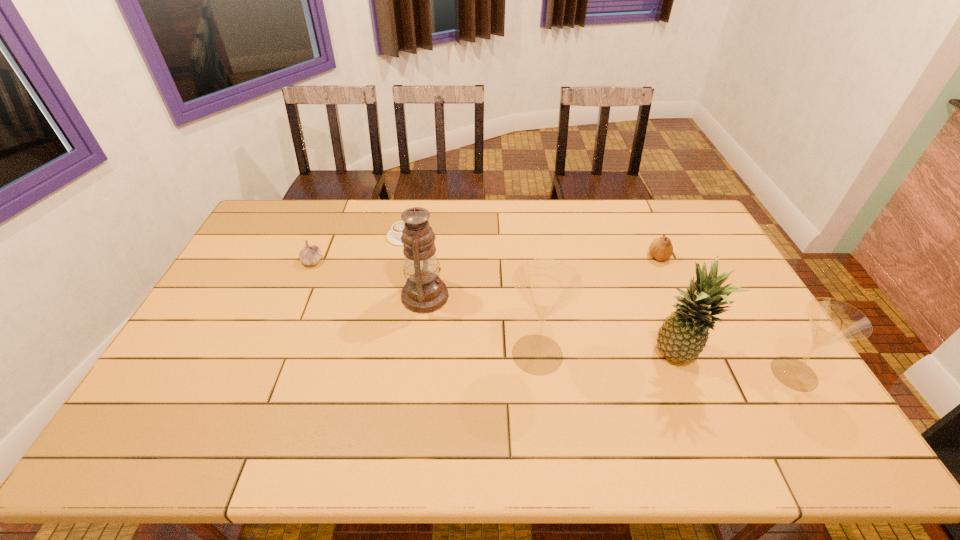
Locate an element on the screen. The width and height of the screenshot is (960, 540). unoccupied area between the pear and the pineapple is located at coordinates (667, 307).

Where is `vacant space that's between the pear and the taller flute glass`? vacant space that's between the pear and the taller flute glass is located at coordinates (598, 306).

Image resolution: width=960 pixels, height=540 pixels. I want to click on free space between the left flute glass and the rightmost object, so click(666, 364).

This screenshot has width=960, height=540. I want to click on unoccupied area between the cappuccino and the pear, so point(531,247).

Find the location of a particular element. This screenshot has width=960, height=540. empty space between the pear and the fourth object from left to right is located at coordinates (598, 306).

In order to click on free space between the left flute glass and the pear in this screenshot , I will do 598,306.

Locate an element on the screen. This screenshot has height=540, width=960. empty space that is in between the pear and the right flute glass is located at coordinates (727, 315).

Where is `free space between the shortest object and the third tallest object`? The height and width of the screenshot is (540, 960). free space between the shortest object and the third tallest object is located at coordinates (470, 295).

Where is `object that is the closest to the pear`? object that is the closest to the pear is located at coordinates (682, 337).

This screenshot has height=540, width=960. Identify the location of the sixth closest object to the shortest object. (832, 321).